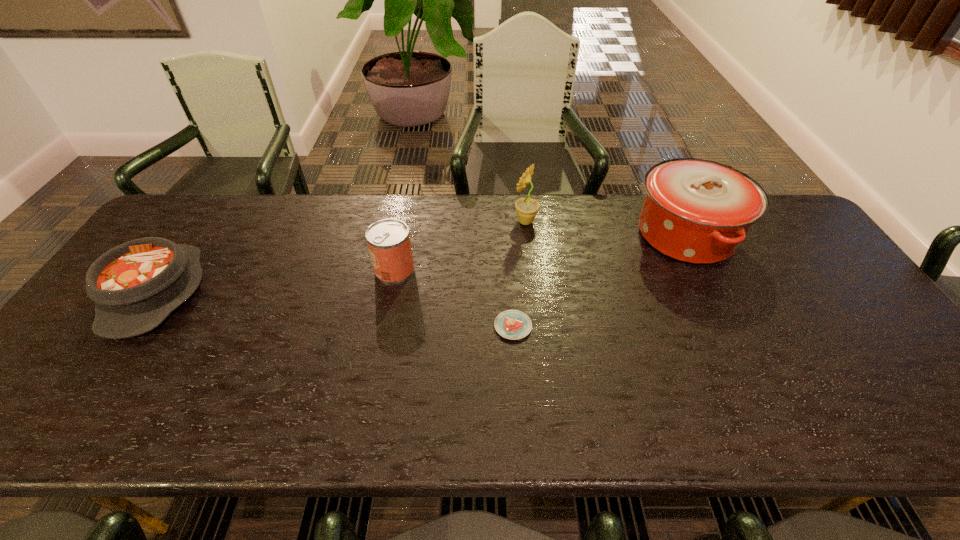
Locate an element on the screen. the taller casserole is located at coordinates (697, 211).

What are the coordinates of `the right casserole` in the screenshot? It's located at (697, 211).

Where is `sunflower`? The image size is (960, 540). sunflower is located at coordinates (526, 208).

The image size is (960, 540). Identify the location of can. (388, 240).

Find the location of `the third shortest object`. the third shortest object is located at coordinates (388, 240).

In order to click on the leftmost object in this screenshot , I will do `click(135, 286)`.

Where is `the left casserole`? The width and height of the screenshot is (960, 540). the left casserole is located at coordinates (135, 286).

The width and height of the screenshot is (960, 540). I want to click on pastry, so coord(512,324).

Where is `vacant space situated 0.160m on the left of the taller casserole`? This screenshot has height=540, width=960. vacant space situated 0.160m on the left of the taller casserole is located at coordinates (580, 235).

Where is `vacant space situated 0.180m on the face of the sunflower`? This screenshot has width=960, height=540. vacant space situated 0.180m on the face of the sunflower is located at coordinates (456, 221).